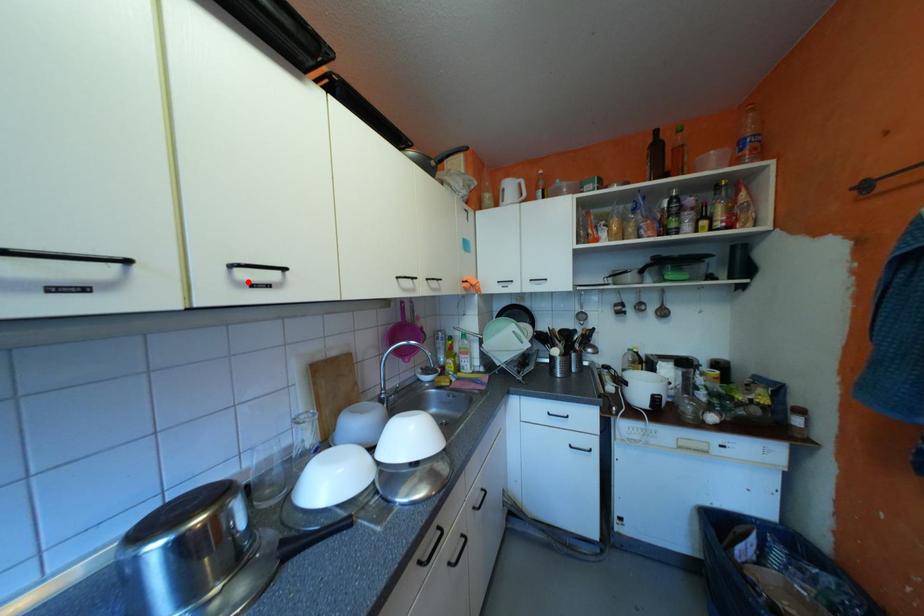
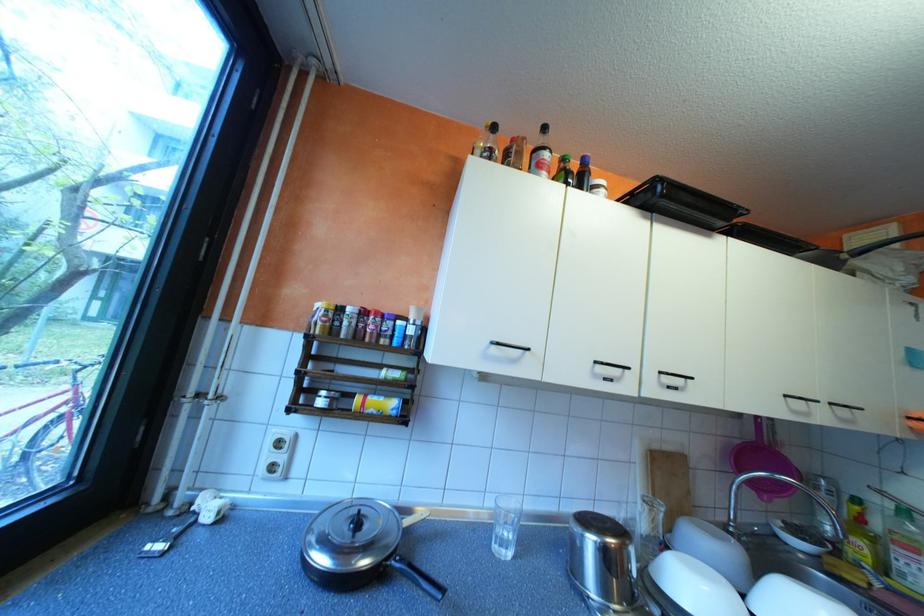
The point at the highlighted location is marked in the first image. Where is the corresponding point in the second image?

(673, 383)